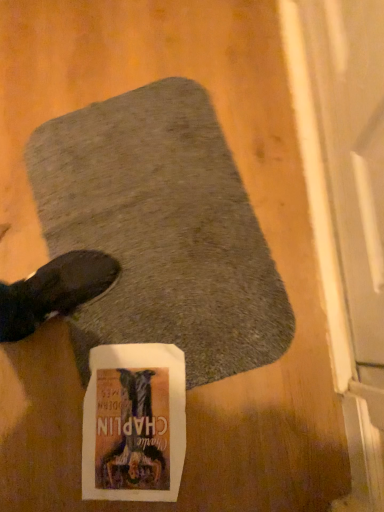
You are a GUI agent. You are given a task and a screenshot of the screen. Output one action in this format:
    pyautogui.click(x=<x>, y=<y>)
    Task: Click on the free space below white paper flyer at center (from a real-world perspective)
    
    Given the screenshot: What is the action you would take?
    pyautogui.click(x=137, y=451)